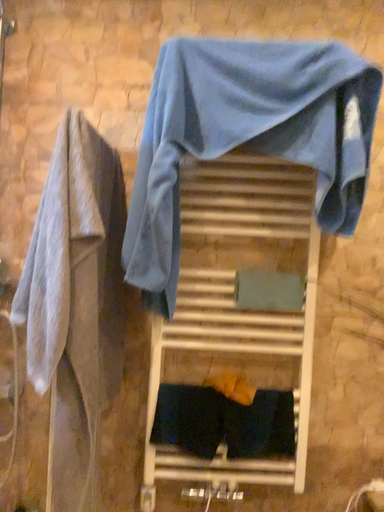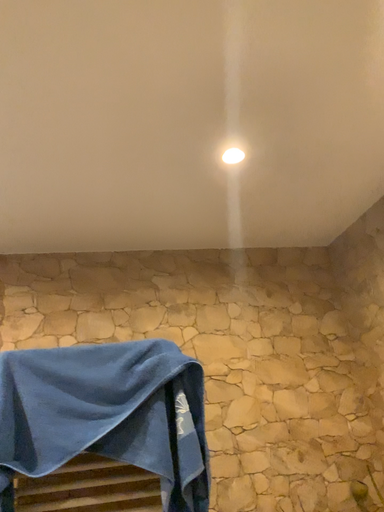
Question: How did the camera likely rotate when shooting the video?

Choices:
 (A) rotated left
 (B) rotated right

Answer: (B)